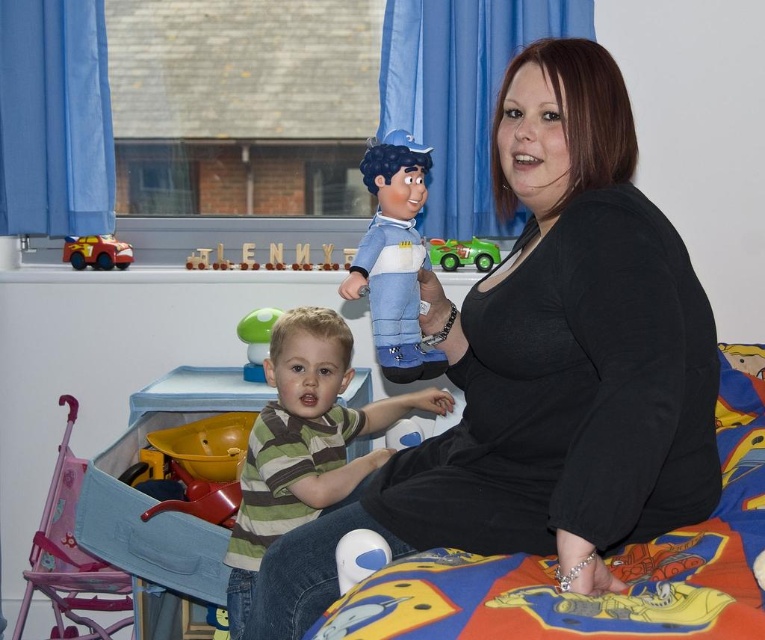
Question: Which object appears farthest from the camera in this image?

Choices:
 (A) matte blue plush at center
 (B) striped cotton shirt at center
 (C) green matte car at center
 (D) superman-themed fabric bed at lower right

Answer: (C)

Question: Which point is closer to the camera taking this photo?

Choices:
 (A) (72, 240)
 (B) (454, 253)
 (C) (594, 83)
 (D) (331, 496)

Answer: (C)

Question: Which of the following is the closest to the observer?

Choices:
 (A) [555, 230]
 (B) [80, 264]
 (C) [251, 362]

Answer: (A)

Question: Can you confirm if matte red car at left is thinner than green rubber toy at center?

Choices:
 (A) yes
 (B) no

Answer: (B)

Question: Is black matte shirt at center bigger than green matte car at center?

Choices:
 (A) yes
 (B) no

Answer: (A)

Question: From the image, what is the correct spatial relationship of striped cotton shirt at center in relation to matte red car at left?

Choices:
 (A) below
 (B) above

Answer: (A)